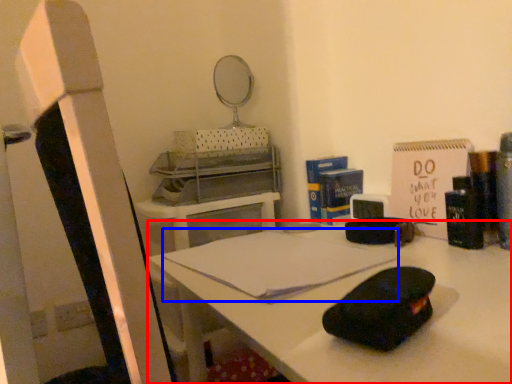
Question: Which object appears closest to the camera in this image, desk (highlighted by a red box) or notebook (highlighted by a blue box)?

Choices:
 (A) desk
 (B) notebook

Answer: (A)